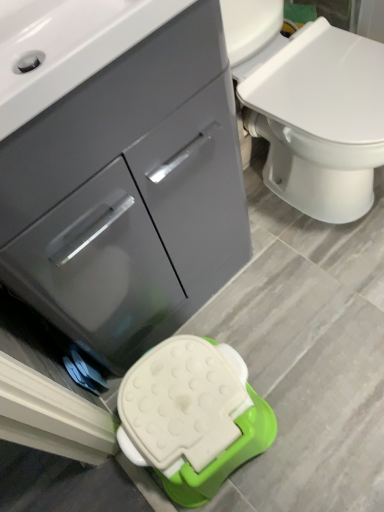
The image size is (384, 512). Find the location of `free point to the right of matte gray cabinet at center`. free point to the right of matte gray cabinet at center is located at coordinates (296, 280).